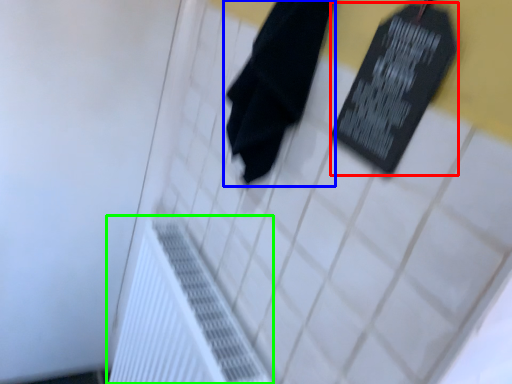
Question: Estimate the real-world distances between objects in this image. Which object is closer to bulletin board (highlighted by a red box), towel (highlighted by a blue box) or radiator (highlighted by a green box)?

Choices:
 (A) towel
 (B) radiator

Answer: (A)